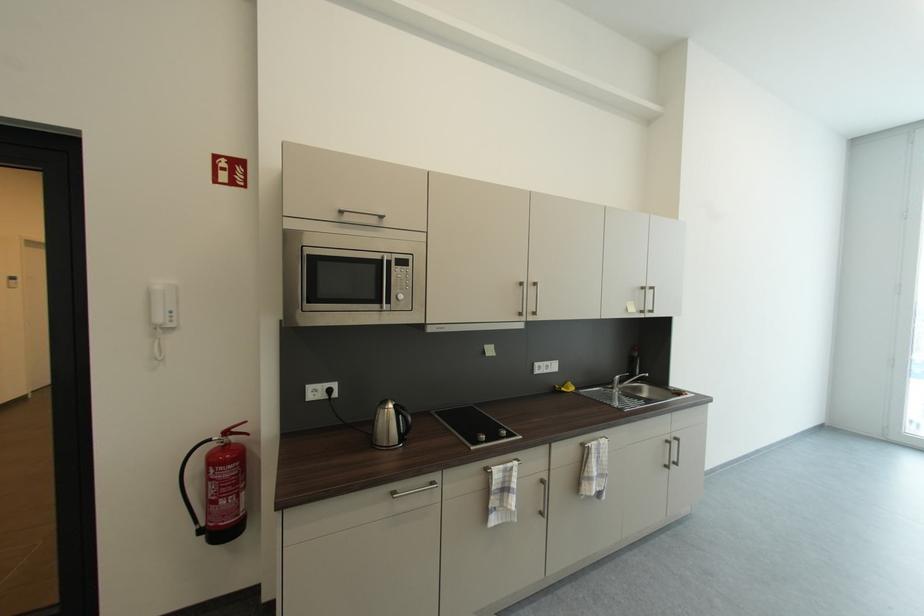
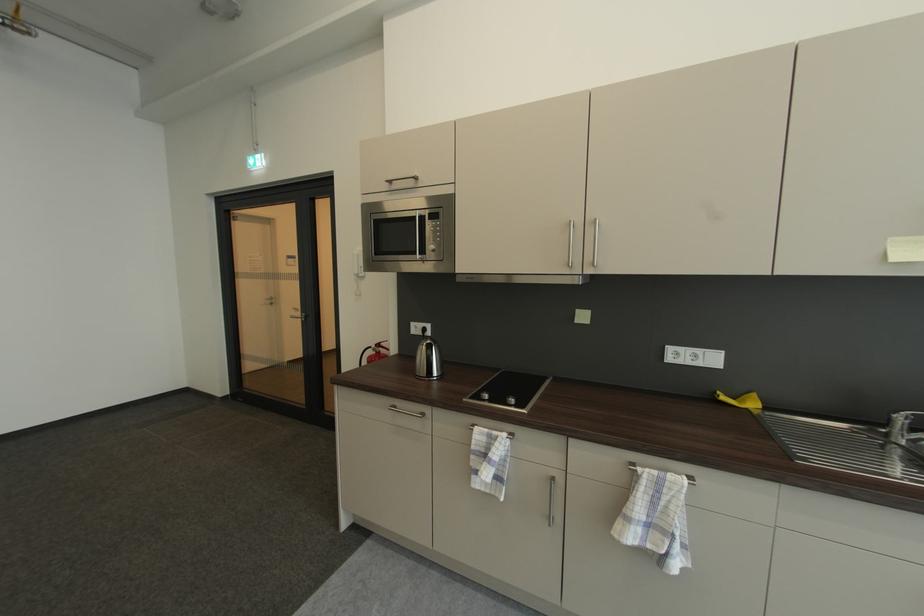
Find the pixel in the second image that matches point 403,261 in the first image.

(436, 215)